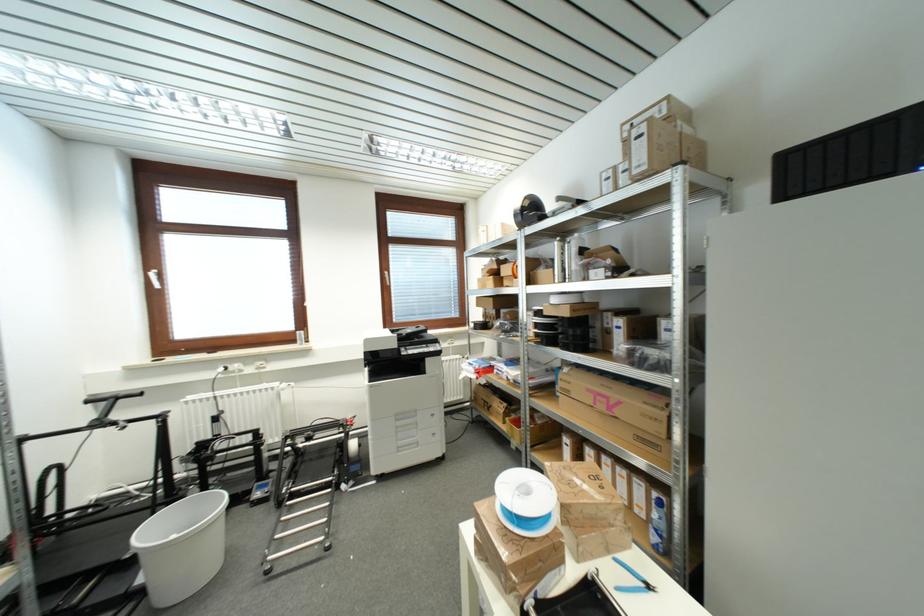
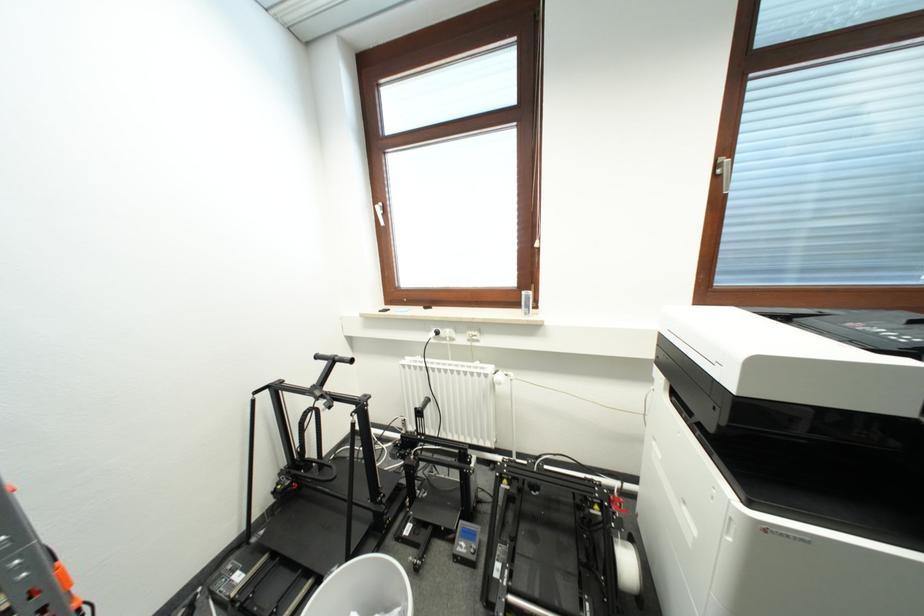
Find the pixel in the second image that matches point (151, 273) in the first image.

(379, 206)